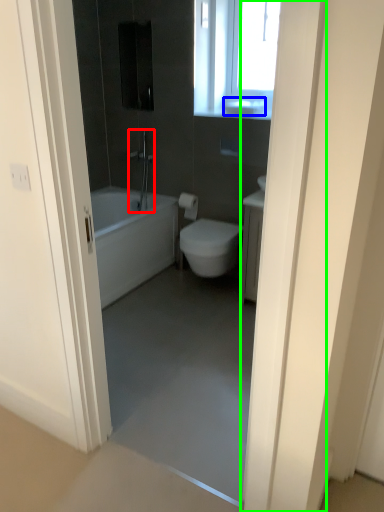
Question: Which object is the closest to the shower (highlighted by a red box)? Choose among these: sink (highlighted by a blue box) or door (highlighted by a green box).

Choices:
 (A) sink
 (B) door

Answer: (A)